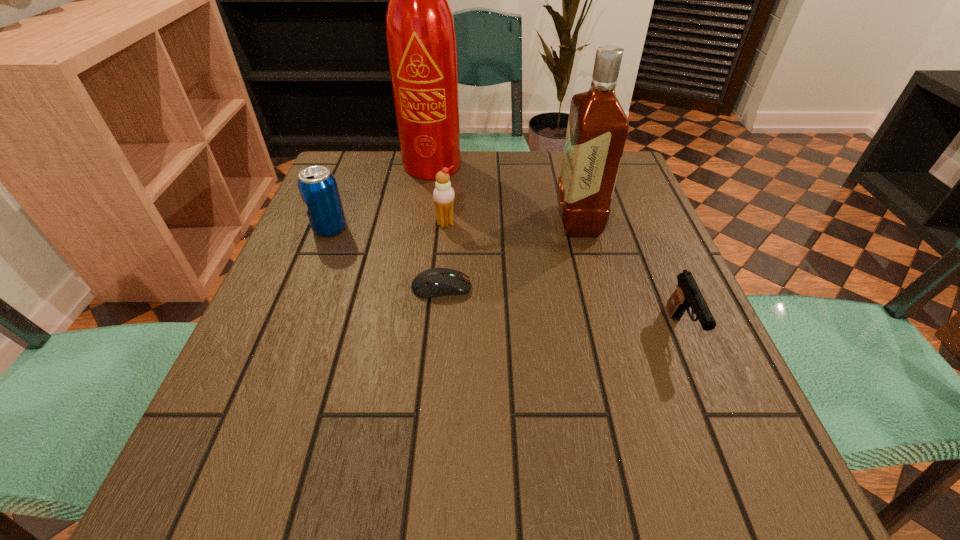
The height and width of the screenshot is (540, 960). I want to click on vacant region between the second nearest object and the fire extinguisher, so click(x=439, y=226).

In order to click on vacant space that is in between the fifth farthest object and the pop soda in this screenshot , I will do coord(386,258).

Where is `free space that is in between the liquor and the second nearest object`? This screenshot has width=960, height=540. free space that is in between the liquor and the second nearest object is located at coordinates (510, 254).

Where is `vacant area that lies between the nearest object and the pop soda`? vacant area that lies between the nearest object and the pop soda is located at coordinates (506, 280).

The height and width of the screenshot is (540, 960). Identify the location of free space between the nearest object and the fire extinguisher. (559, 248).

You are a GUI agent. You are given a task and a screenshot of the screen. Output one action in this format:
    pyautogui.click(x=<x>, y=<y>)
    Task: Click on the object that stands as the closest to the icecream
    
    Given the screenshot: What is the action you would take?
    pyautogui.click(x=434, y=282)

I want to click on object that ranks as the second closest to the liquor, so click(421, 40).

At what (x,y) coordinates should I click in order to perform the action: click on blank space that satisfies the following two spatial constraints: 1. on the front label of the fifth object from left to right; 2. on the front side of the leftmost object. Please return your answer as a coordinate pair (x, y). This screenshot has height=540, width=960. Looking at the image, I should click on (581, 228).

Locate an element on the screen. free point that satisfies the following two spatial constraints: 1. on the front label of the second tallest object; 2. at the front with a straw on the icecream is located at coordinates (579, 223).